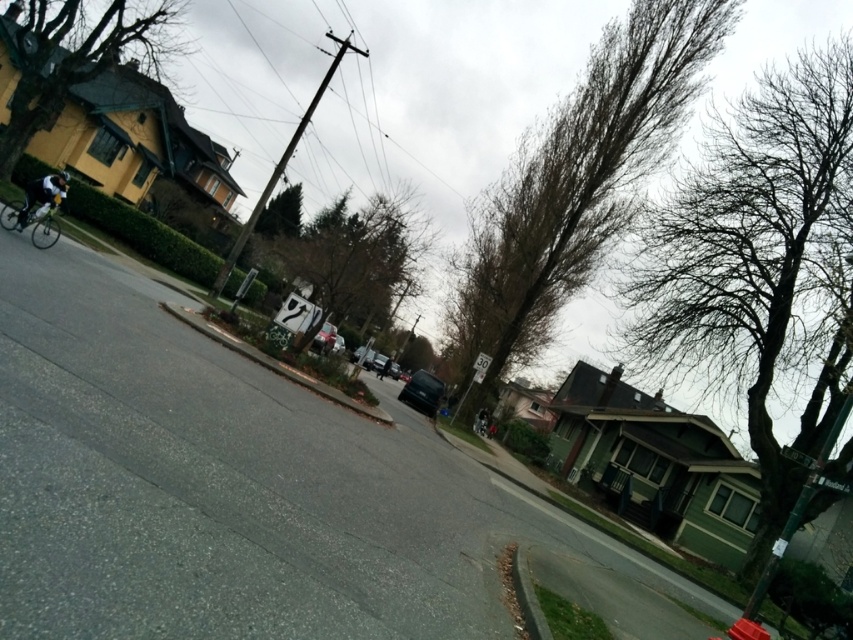
Does green textured tree at upper left appear over shiny silver bicycle at left?

Yes, green textured tree at upper left is above shiny silver bicycle at left.

Between green textured tree at upper left and shiny silver bicycle at left, which one has less height?

shiny silver bicycle at left

Where is `green textured tree at upper left`? This screenshot has height=640, width=853. green textured tree at upper left is located at coordinates (73, 58).

Identify the location of green textured tree at upper left. (73, 58).

Can you confirm if bare branches at upper center is positioned above green leafy tree at center?

No, bare branches at upper center is not above green leafy tree at center.

Is bare branches at upper center wider than green leafy tree at center?

No.

Is point (576, 150) more distant than point (314, 218)?

No, (576, 150) is closer to viewer.

Identify the location of bare branches at upper center. This screenshot has width=853, height=640. (587, 173).

Can you confirm if bare branches at upper right is positioned to the left of bare branches at upper center?

In fact, bare branches at upper right is to the right of bare branches at upper center.

Locate an element on the screen. bare branches at upper right is located at coordinates (762, 273).

Where is `bare branches at upper right`? Image resolution: width=853 pixels, height=640 pixels. bare branches at upper right is located at coordinates (762, 273).